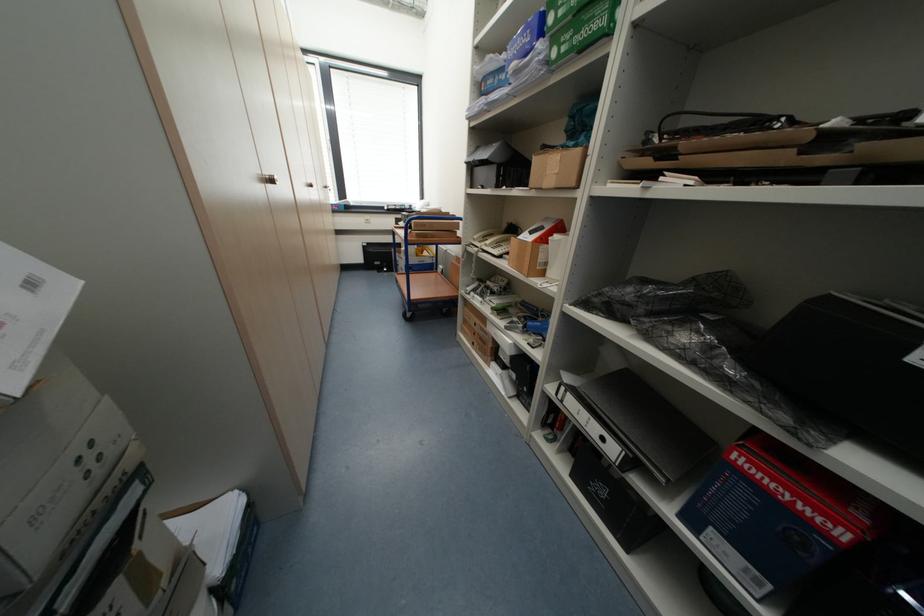
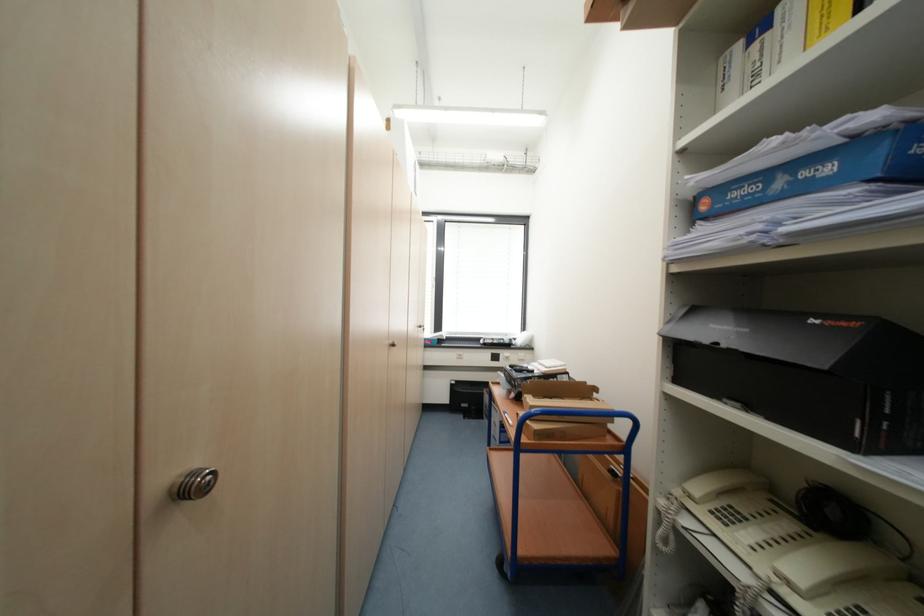
The point at (424, 236) is marked in the first image. Where is the corresponding point in the second image?

(544, 436)